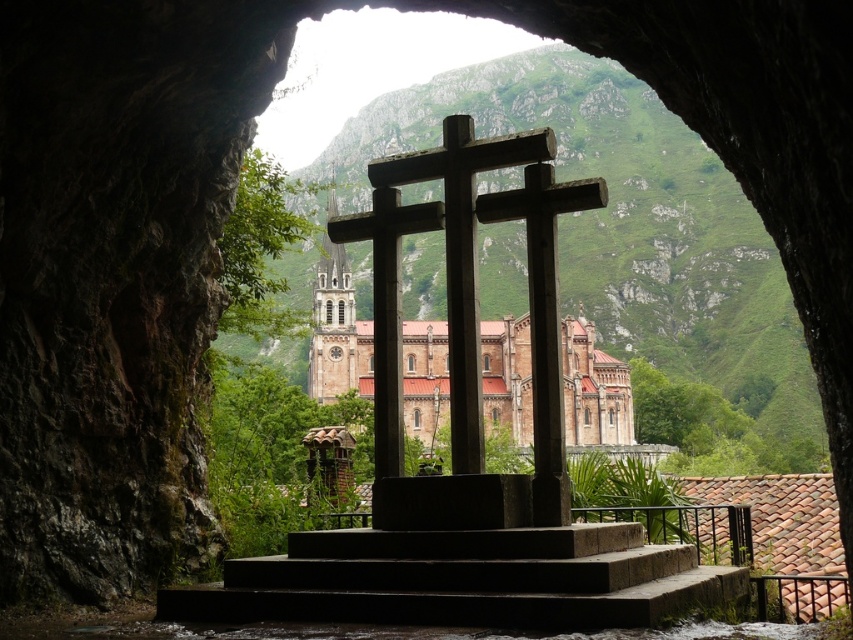
You are standing at the entrance of the cave and want to reach the point marked at coordinates point (637,582). If your maximum walking distance is 50 meters, can you reach it without exceeding your limit?

The point (637,582) is 52.03 meters away from the viewer, which exceeds your maximum walking distance of 50 meters. Therefore, you cannot reach it without exceeding your limit.

You are a hiker who wants to climb up the dark gray concrete stairs at center to get a better view of the rustic wood cross at center. Can you reach the cross from the stairs?

The dark gray concrete stairs at center is smaller than rustic wood cross at center, so yes, you can reach the cross from the stairs as the stairs are positioned below the cross and lead up to its platform.

You are standing at the base of the dark gray concrete stairs at center and want to climb up to the rustic wood cross at center. Can you reach the cross without needing to climb the stairs?

The dark gray concrete stairs at center is shorter than rustic wood cross at center, so yes, you can reach the cross without needing to climb the stairs since the stairs are shorter than the cross.